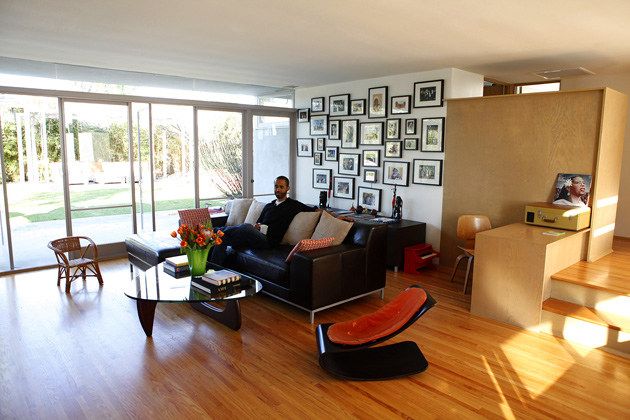
Locate an element on the screen. back of cabinets is located at coordinates [518, 124].